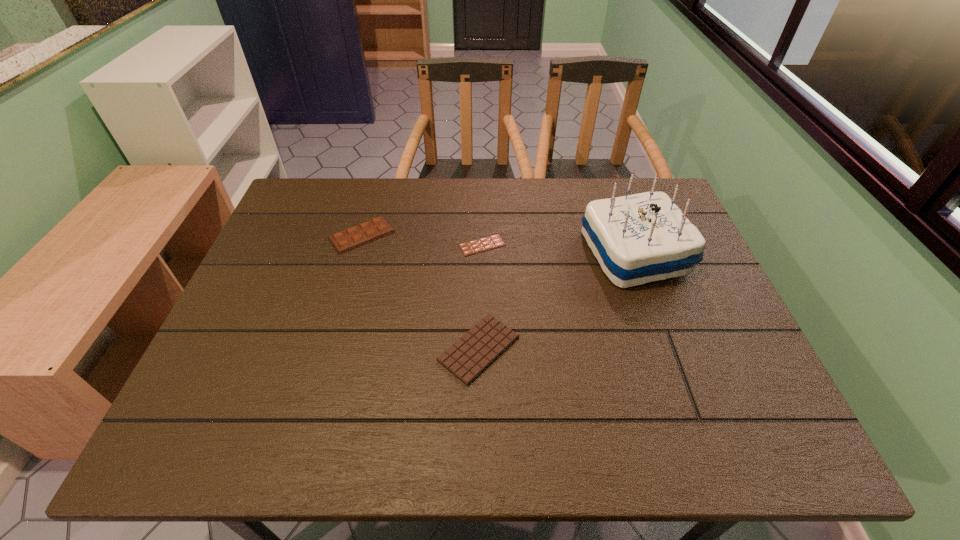
Find the location of a particular element. The height and width of the screenshot is (540, 960). vacant region located 0.050m on the right of the shortest chocolate bar is located at coordinates (524, 245).

Find the location of a particular element. The height and width of the screenshot is (540, 960). birthday cake at the far edge is located at coordinates (640, 238).

The image size is (960, 540). I want to click on chocolate bar positioned at the far edge, so click(351, 238).

Where is `object at the left edge`? object at the left edge is located at coordinates (351, 238).

At what (x,y) coordinates should I click in order to perform the action: click on object at the right edge. Please return your answer as a coordinate pair (x, y). Looking at the image, I should click on (640, 238).

The image size is (960, 540). I want to click on object present at the far left corner, so click(x=351, y=238).

You are a GUI agent. You are given a task and a screenshot of the screen. Output one action in this format:
    pyautogui.click(x=<x>, y=<y>)
    Task: Click on the object located in the far right corner section of the desktop
    
    Given the screenshot: What is the action you would take?
    pyautogui.click(x=640, y=238)

This screenshot has width=960, height=540. I want to click on vacant point at the far edge, so click(x=426, y=218).

I want to click on vacant space at the near edge of the desktop, so click(x=392, y=431).

At what (x,y) coordinates should I click in order to perform the action: click on vacant space at the left edge of the desktop. Please return your answer as a coordinate pair (x, y). The width and height of the screenshot is (960, 540). Looking at the image, I should click on (306, 230).